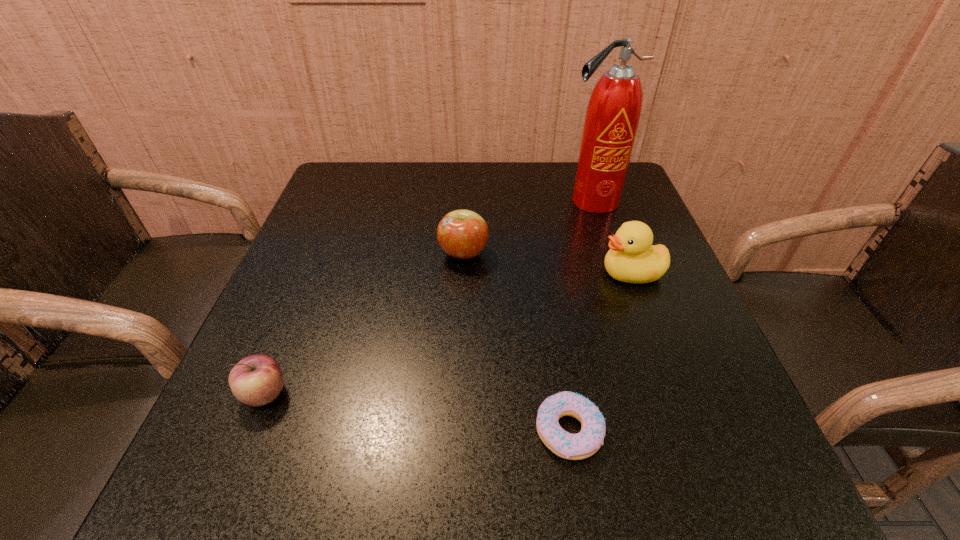
Where is `free space between the doughnut and the farthest object`? The width and height of the screenshot is (960, 540). free space between the doughnut and the farthest object is located at coordinates (580, 316).

Identify the location of empty space that is in between the doughnut and the fire extinguisher. (580, 316).

Locate an element on the screen. unoccupied area between the left apple and the farther apple is located at coordinates (365, 323).

The height and width of the screenshot is (540, 960). Identify the location of free space between the nearer apple and the fourth object from right to left. (365, 323).

The width and height of the screenshot is (960, 540). What are the coordinates of `free area in between the doughnut and the tallest object` in the screenshot? It's located at (580, 316).

In order to click on free space between the shortest object and the farthest object in this screenshot , I will do `click(580, 316)`.

Identify the location of empty space between the farthest object and the left apple. This screenshot has height=540, width=960. (428, 298).

In order to click on free spot between the right apple and the farthest object in this screenshot , I will do `click(528, 227)`.

Where is `object that is the second closest to the tallest object`? The height and width of the screenshot is (540, 960). object that is the second closest to the tallest object is located at coordinates (463, 234).

This screenshot has height=540, width=960. Find the location of `the third closest object to the farthest object`. the third closest object to the farthest object is located at coordinates (587, 442).